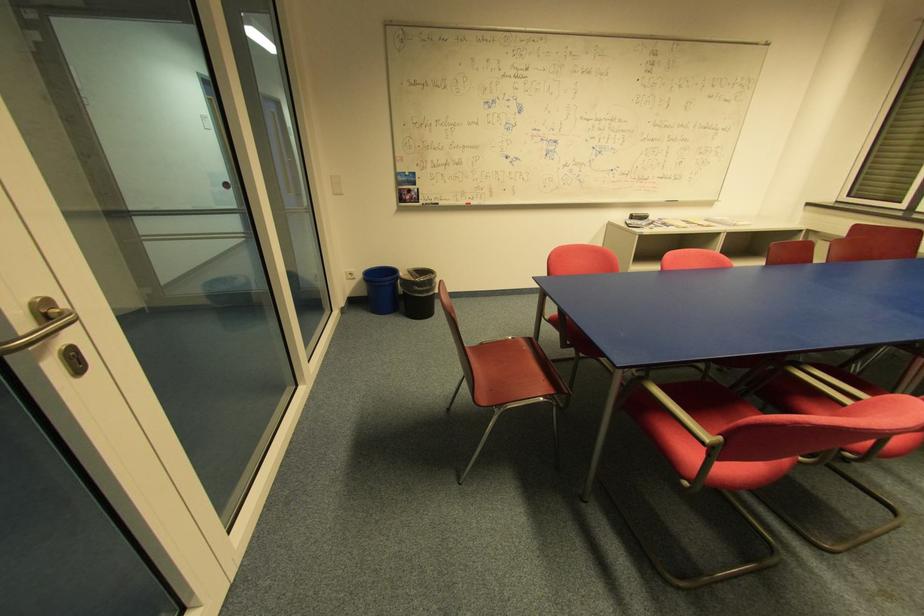
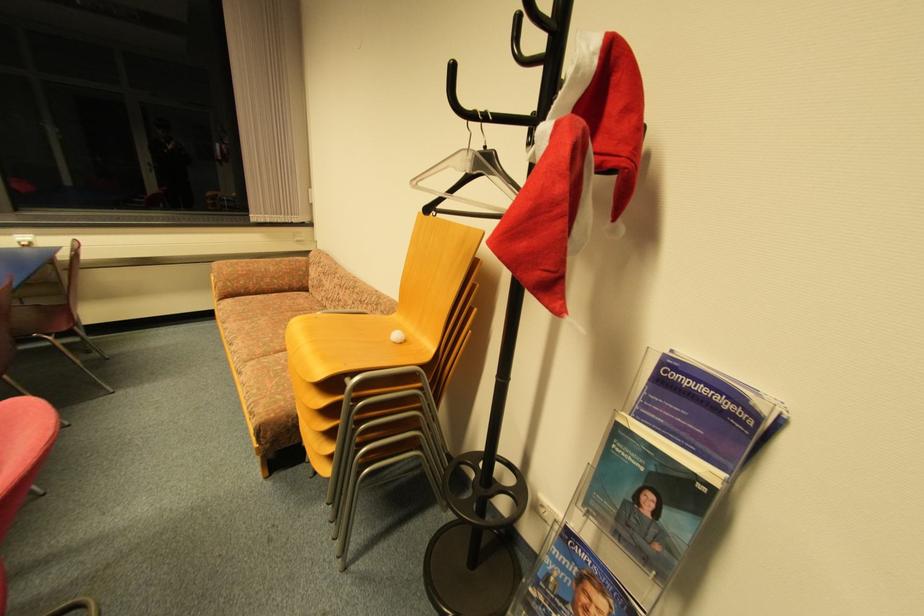
Looking at this image, how did the camera likely rotate?

The rotation direction of the camera is right-down.